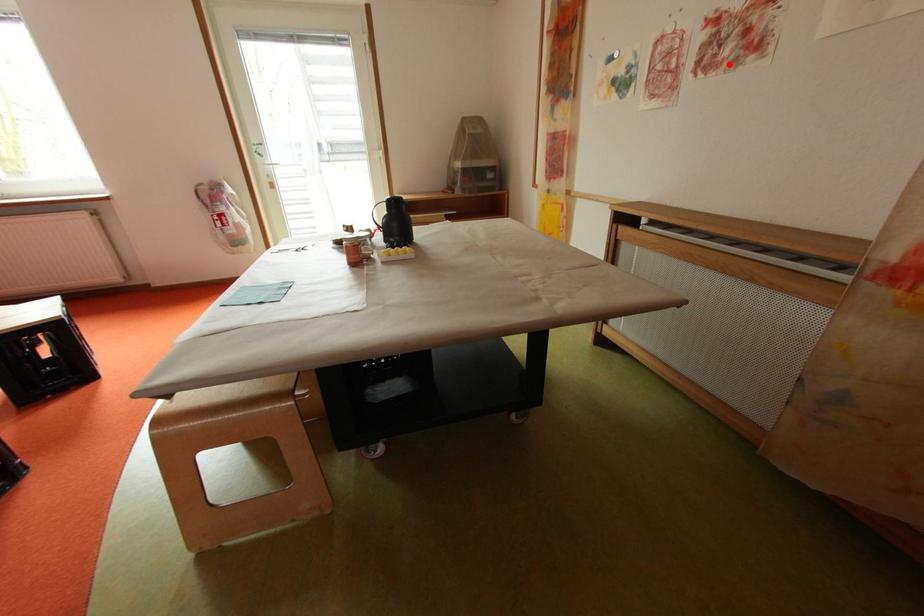
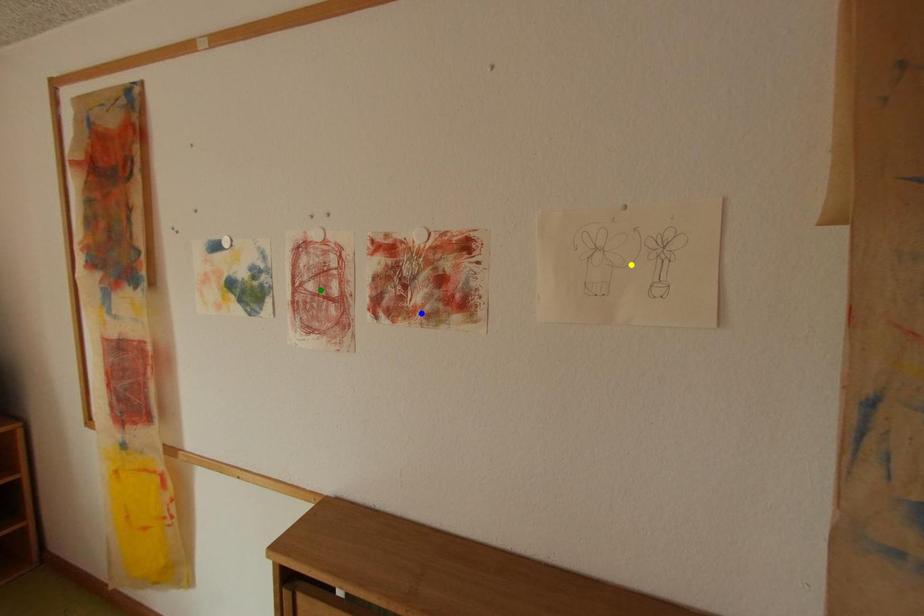
Question: I am providing you with two images of the same scene from different viewpoints. A red point is marked on the first image. You are given multiple points on the second image. In image 2, which mark is for the same physical point as the one in image 1?

Choices:
 (A) yellow point
 (B) blue point
 (C) green point

Answer: (B)